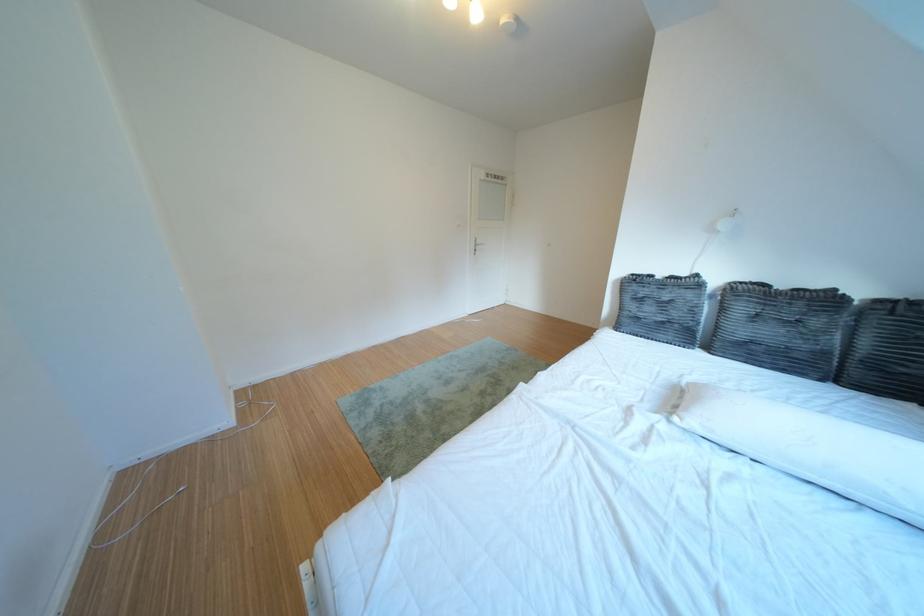
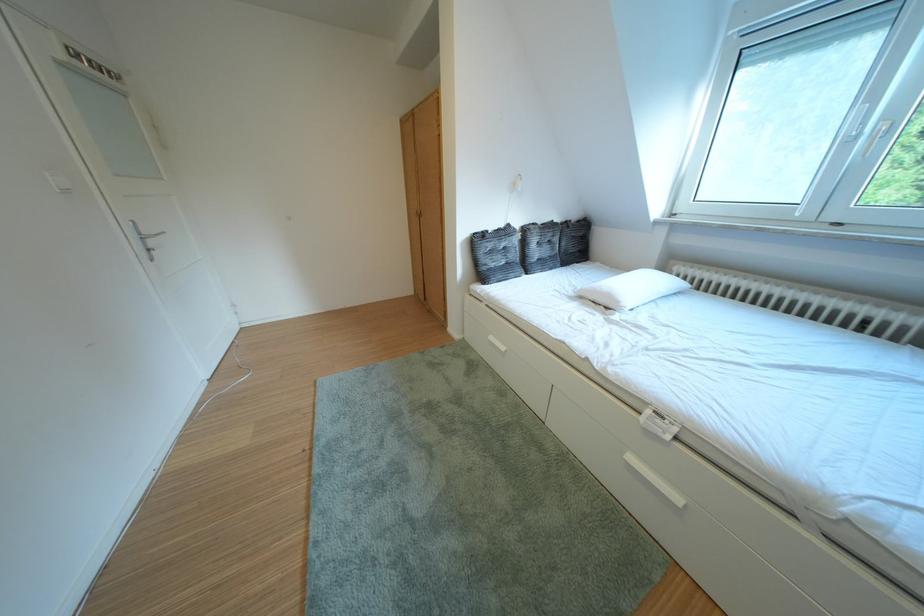
Find the pixel in the second image that matches [711,281] in the first image.

(523, 230)